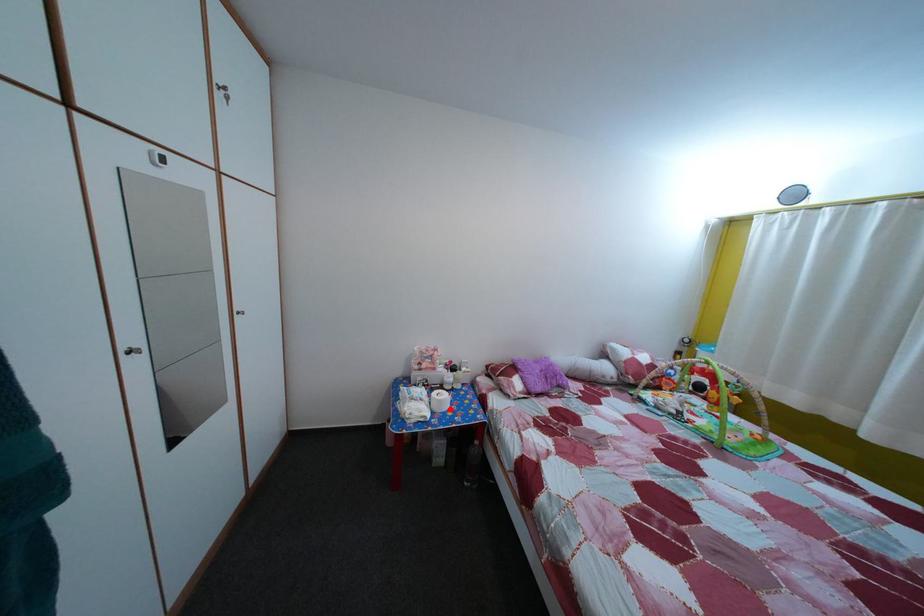
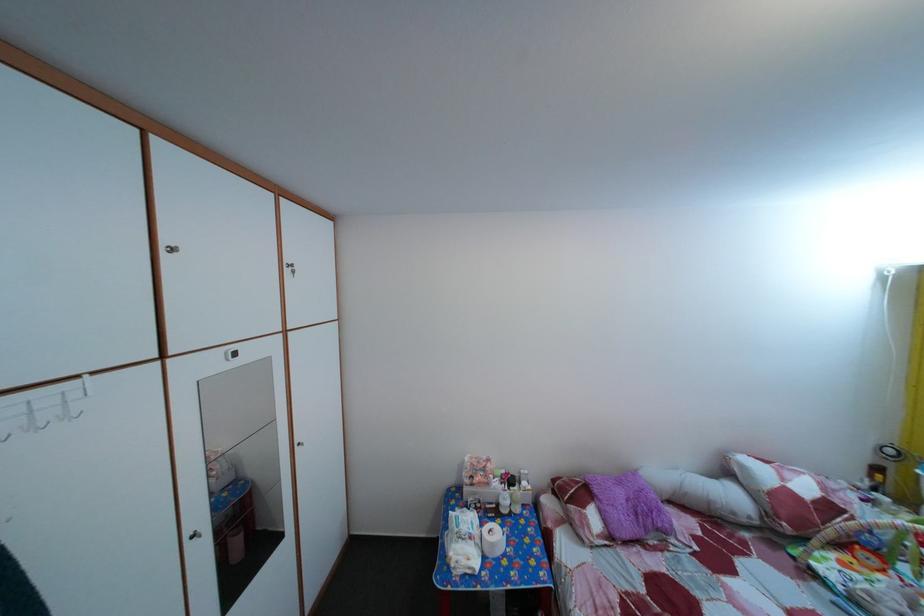
Question: A red point is marked in image1. In image2, is the corresponding 3D point closer to the camera or farther? Reply with the corresponding letter.

Choices:
 (A) The corresponding 3D point is closer.
 (B) The corresponding 3D point is farther.

Answer: (A)